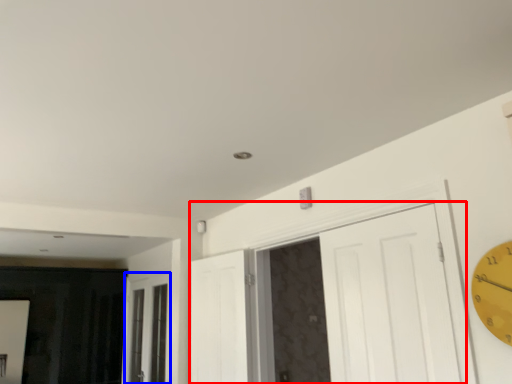
Question: Which object appears farthest to the camera in this image, door (highlighted by a red box) or window (highlighted by a blue box)?

Choices:
 (A) door
 (B) window

Answer: (B)